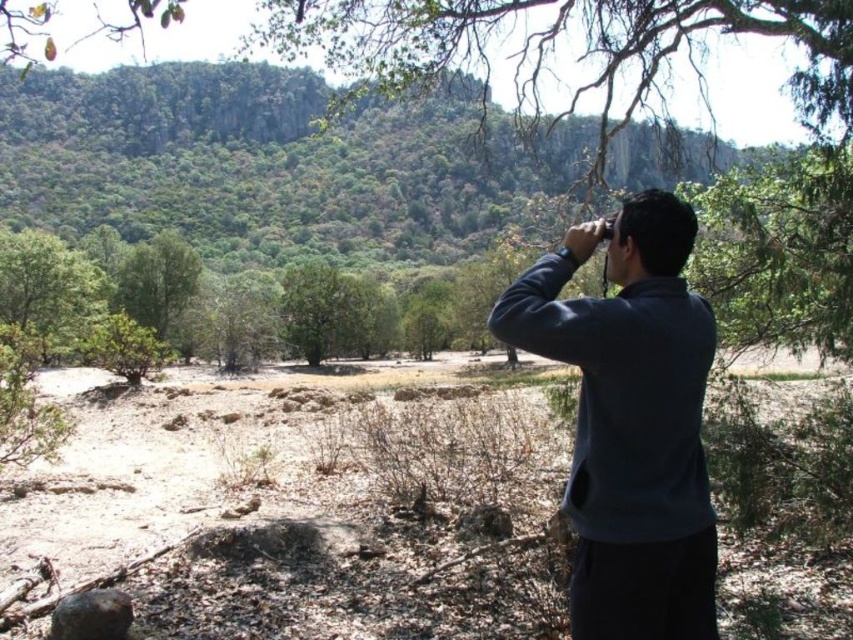
Question: Observing the image, what is the correct spatial positioning of dark blue sweatshirt at right in reference to green leafy tree at center?

Choices:
 (A) left
 (B) right

Answer: (B)

Question: Considering the real-world distances, which object is closest to the dark blue sweatshirt at right?

Choices:
 (A) green matte tree at center
 (B) green leafy tree at center
 (C) green leafy tree at left

Answer: (C)

Question: Is dark blue sweatshirt at right to the right of green matte tree at center from the viewer's perspective?

Choices:
 (A) yes
 (B) no

Answer: (A)

Question: Which object is positioned farthest from the green leafy tree at center?

Choices:
 (A) dark blue sweatshirt at right
 (B) green leafy tree at left

Answer: (A)

Question: Which point appears closest to the camera in this image?

Choices:
 (A) (599, 474)
 (B) (131, 272)
 (C) (323, 260)

Answer: (A)

Question: Is dark blue sweatshirt at right in front of green leafy tree at left?

Choices:
 (A) no
 (B) yes

Answer: (B)